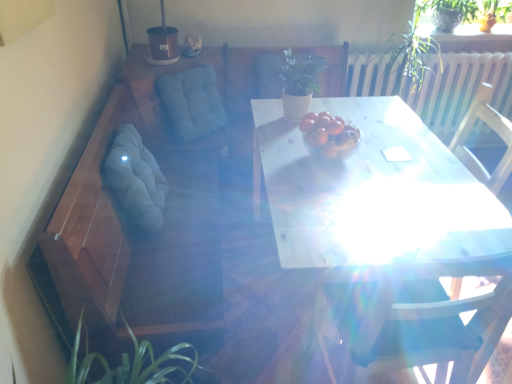
Locate an element on the screen. green leafy plant at upper right, which is the first plant from top to bottom is located at coordinates (494, 10).

What is the approximate width of soft gray fabric swivel chair at left, marked as the first swivel chair in a front-to-back arrangement?

It is 6.54 inches.

What do you see at coordinates (192, 102) in the screenshot? The height and width of the screenshot is (384, 512). I see `blue fabric cushion at upper left, which appears as the 1th swivel chair when viewed from the back` at bounding box center [192, 102].

Identify the location of green fabric armchair at upper center. (250, 76).

In order to face green matte plant at center, the second plant viewed from the top, should I rotate leftwards or rightwards?

To face it directly, rotate right by 4.943 degrees.

What do you see at coordinates (298, 72) in the screenshot? I see `green matte plant at center, the 2th plant viewed from the right` at bounding box center [298, 72].

Where is `green leafy plant at upper right, which is the first plant from top to bottom`? green leafy plant at upper right, which is the first plant from top to bottom is located at coordinates (494, 10).

Is blue fabric cushion at upper left, which appears as the second swivel chair when viewed from the front, smaller than green matte plant at center, acting as the 1th plant starting from the bottom?

No.

Which is behind, blue fabric cushion at upper left, which appears as the second swivel chair when viewed from the front, or green matte plant at center, acting as the 1th plant starting from the bottom?

Positioned behind is green matte plant at center, acting as the 1th plant starting from the bottom.

Looking at this image, is blue fabric cushion at upper left, which appears as the 1th swivel chair when viewed from the back, to the left of green matte plant at center, acting as the 1th plant starting from the bottom, from the viewer's perspective?

Yes, blue fabric cushion at upper left, which appears as the 1th swivel chair when viewed from the back, is to the left of green matte plant at center, acting as the 1th plant starting from the bottom.

Is translucent glass bowl at center far from white glossy table at center?

No, there isn't a large distance between translucent glass bowl at center and white glossy table at center.

Considering the relative sizes of translucent glass bowl at center and white glossy table at center in the image provided, is translucent glass bowl at center taller than white glossy table at center?

In fact, translucent glass bowl at center may be shorter than white glossy table at center.

From the image's perspective, which is below, translucent glass bowl at center or white glossy table at center?

white glossy table at center appears lower in the image.

There is a white glossy table at center. In order to click on the 1st swivel chair above it (from a real-world perspective) in this screenshot , I will do `click(136, 178)`.

In the scene shown: Measure the distance between soft gray fabric swivel chair at left, marked as the first swivel chair in a front-to-back arrangement, and white glossy table at center.

They are 77.84 centimeters apart.

Does soft gray fabric swivel chair at left, marked as the first swivel chair in a front-to-back arrangement, have a greater height compared to white glossy table at center?

Incorrect, the height of soft gray fabric swivel chair at left, marked as the first swivel chair in a front-to-back arrangement, is not larger of that of white glossy table at center.

Could you tell me if white glossy table at center is turned towards green matte plant at center, placed as the first plant when sorted from left to right?

Yes, white glossy table at center is oriented towards green matte plant at center, placed as the first plant when sorted from left to right.

Which plant is the 1st one when counting from the back of the white glossy table at center? Please provide its 2D coordinates.

[(298, 72)]

From a real-world perspective, is white glossy table at center positioned above or below green matte plant at center, the second plant viewed from the top?

From a real-world perspective, white glossy table at center is physically below green matte plant at center, the second plant viewed from the top.

Is the position of white glossy table at center more distant than that of green matte plant at center, placed as the first plant when sorted from left to right?

No, white glossy table at center is closer to the viewer.

Is green leafy plant at upper right, placed as the second plant when sorted from left to right, bigger than white glossy table at center?

Actually, green leafy plant at upper right, placed as the second plant when sorted from left to right, might be smaller than white glossy table at center.

Does green leafy plant at upper right, the 2th plant positioned from the bottom, turn towards white glossy table at center?

No, green leafy plant at upper right, the 2th plant positioned from the bottom, is not aimed at white glossy table at center.

From the picture: Which is closer to the camera, (503, 21) or (325, 107)?

The point (325, 107) is closer to the camera.

From a real-world perspective, does green leafy plant at upper right, placed as the second plant when sorted from left to right, sit lower than white glossy table at center?

No, from a real-world perspective, green leafy plant at upper right, placed as the second plant when sorted from left to right, is not below white glossy table at center.

Is white glossy table at center positioned in front of blue fabric cushion at upper left, which appears as the 1th swivel chair when viewed from the back?

Yes, white glossy table at center is closer to the viewer.

Where is `the 2nd swivel chair behind when counting from the white glossy table at center`? The width and height of the screenshot is (512, 384). the 2nd swivel chair behind when counting from the white glossy table at center is located at coordinates (192, 102).

Between white glossy table at center and blue fabric cushion at upper left, which appears as the 1th swivel chair when viewed from the back, which one has larger size?

white glossy table at center.

Measure the distance from white glossy table at center to blue fabric cushion at upper left, which appears as the 1th swivel chair when viewed from the back.

39.25 inches.

Is soft gray fabric swivel chair at left, marked as the first swivel chair in a front-to-back arrangement, a part of blue fabric cushion at upper left, which appears as the second swivel chair when viewed from the front?

That's incorrect, soft gray fabric swivel chair at left, marked as the first swivel chair in a front-to-back arrangement, is not inside blue fabric cushion at upper left, which appears as the second swivel chair when viewed from the front.

From a real-world perspective, which object rests below the other?

From a 3D spatial view, soft gray fabric swivel chair at left, marked as the first swivel chair in a front-to-back arrangement, is below.

From the image's perspective, which is below, blue fabric cushion at upper left, which appears as the second swivel chair when viewed from the front, or soft gray fabric swivel chair at left, marked as the first swivel chair in a front-to-back arrangement?

soft gray fabric swivel chair at left, marked as the first swivel chair in a front-to-back arrangement.

Considering the sizes of objects blue fabric cushion at upper left, which appears as the 1th swivel chair when viewed from the back, and soft gray fabric swivel chair at left, marked as the first swivel chair in a front-to-back arrangement, in the image provided, who is wider, blue fabric cushion at upper left, which appears as the 1th swivel chair when viewed from the back, or soft gray fabric swivel chair at left, marked as the first swivel chair in a front-to-back arrangement,?

blue fabric cushion at upper left, which appears as the 1th swivel chair when viewed from the back, is wider.

Identify the location of swivel chair that is the 1st one when counting downward from the green matte plant at center, the 2th plant viewed from the right (from the image's perspective). The image size is (512, 384). (192, 102).

In order to click on fruit above the white glossy table at center (from the image's perspective) in this screenshot , I will do `click(329, 134)`.

From the image, which object appears to be nearer to green fabric armchair at upper center, blue fabric cushion at upper left, which appears as the second swivel chair when viewed from the front, or green matte plant at center, placed as the first plant when sorted from left to right?

The object closer to green fabric armchair at upper center is blue fabric cushion at upper left, which appears as the second swivel chair when viewed from the front.

Based on their spatial positions, is green fabric armchair at upper center or green leafy plant at upper right, which is the first plant from top to bottom, further from soft gray fabric swivel chair at left, the second swivel chair from the back?

Among the two, green leafy plant at upper right, which is the first plant from top to bottom, is located further to soft gray fabric swivel chair at left, the second swivel chair from the back.

From the image, which object appears to be farther from translucent glass bowl at center, soft gray fabric swivel chair at left, marked as the first swivel chair in a front-to-back arrangement, or green fabric armchair at upper center?

green fabric armchair at upper center lies further to translucent glass bowl at center than the other object.

Looking at the image, which one is located further to blue fabric cushion at upper left, which appears as the second swivel chair when viewed from the front, green leafy plant at upper right, the 2th plant positioned from the bottom, or green matte plant at center, the 2th plant viewed from the right?

green leafy plant at upper right, the 2th plant positioned from the bottom, is further to blue fabric cushion at upper left, which appears as the second swivel chair when viewed from the front.

Considering their positions, is green fabric armchair at upper center positioned closer to translucent glass bowl at center than green matte plant at center, the 2th plant viewed from the right?

green matte plant at center, the 2th plant viewed from the right, is closer to translucent glass bowl at center.

Considering their positions, is blue fabric cushion at upper left, which appears as the 1th swivel chair when viewed from the back, positioned closer to white glossy table at center than green fabric armchair at upper center?

blue fabric cushion at upper left, which appears as the 1th swivel chair when viewed from the back, is positioned closer to the anchor white glossy table at center.

Considering their positions, is white glossy table at center positioned further to green leafy plant at upper right, which is the first plant from top to bottom, than translucent glass bowl at center?

white glossy table at center is further to green leafy plant at upper right, which is the first plant from top to bottom.

Estimate the real-world distances between objects in this image. Which object is further from white glossy table at center, soft gray fabric swivel chair at left, marked as the first swivel chair in a front-to-back arrangement, or green leafy plant at upper right, placed as the second plant when sorted from left to right?

green leafy plant at upper right, placed as the second plant when sorted from left to right, is further to white glossy table at center.

Identify the location of fruit between green fabric armchair at upper center and white glossy table at center vertically. Image resolution: width=512 pixels, height=384 pixels. (329, 134).

Locate an element on the screen. This screenshot has height=384, width=512. swivel chair between soft gray fabric swivel chair at left, marked as the first swivel chair in a front-to-back arrangement, and translucent glass bowl at center, in the horizontal direction is located at coordinates (192, 102).

The width and height of the screenshot is (512, 384). Identify the location of swivel chair between green fabric armchair at upper center and green matte plant at center, acting as the 1th plant starting from the bottom, along the z-axis. (192, 102).

This screenshot has width=512, height=384. In order to click on plant between soft gray fabric swivel chair at left, the second swivel chair from the back, and green leafy plant at upper right, marked as the first plant in a right-to-left arrangement in this screenshot , I will do `click(298, 72)`.